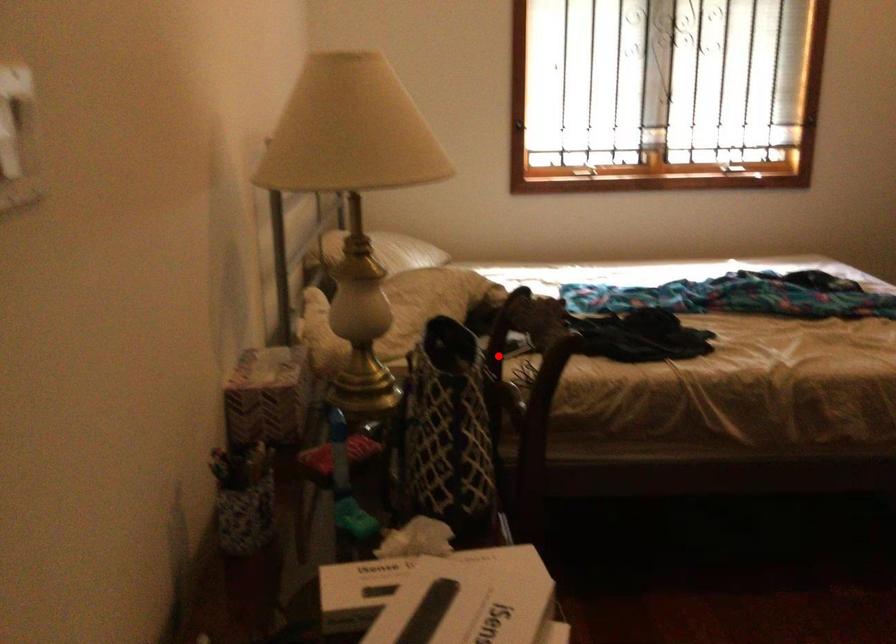
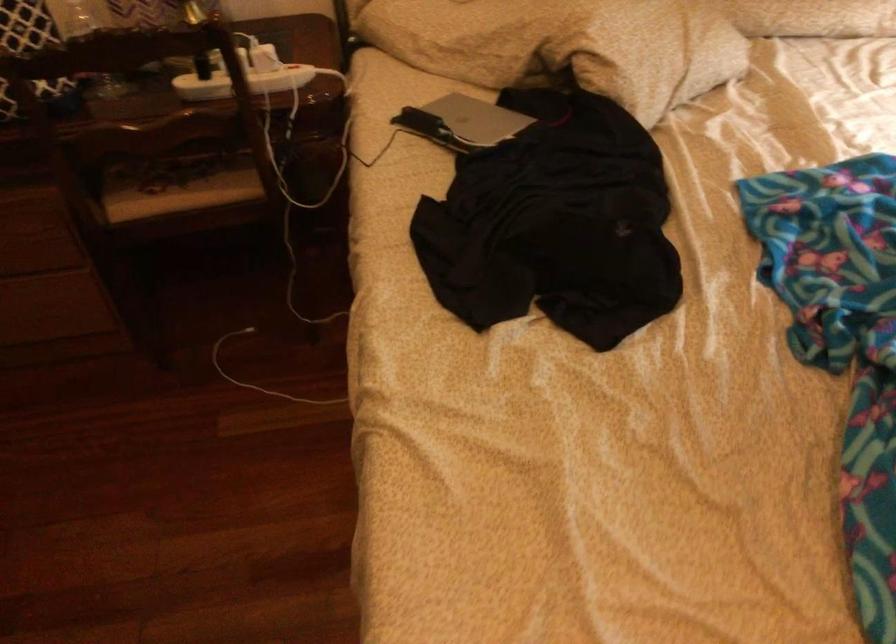
Locate, in the second image, the point that corresponds to the highlighted location in the first image.

(243, 82)